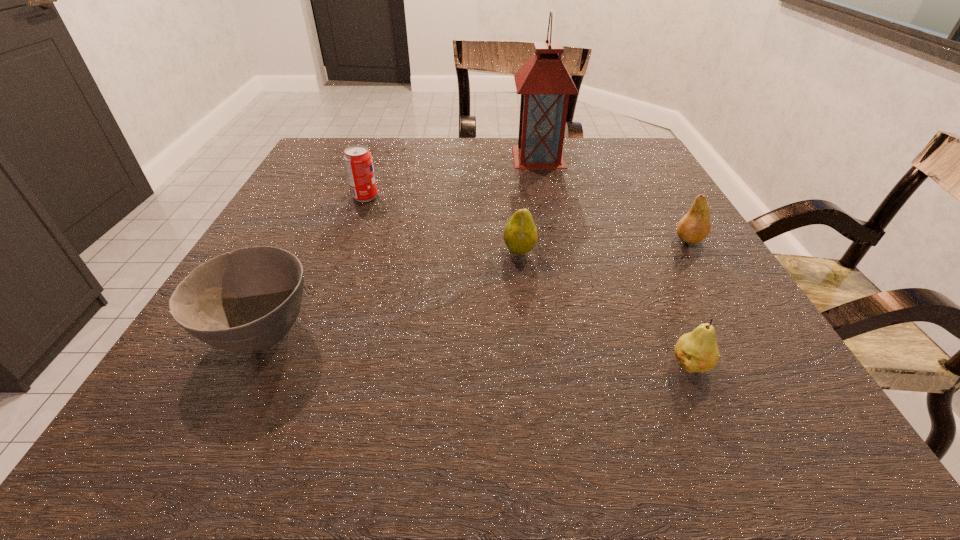
In the image, there is a desktop. Identify the location of vacant space at the right edge. (650, 271).

In the image, there is a desktop. Where is `free space at the far left corner`? free space at the far left corner is located at coordinates (340, 159).

The image size is (960, 540). In order to click on vacant area at the near left corner in this screenshot , I will do `click(175, 420)`.

In the image, there is a desktop. What are the coordinates of `vacant space at the far right corner` in the screenshot? It's located at (598, 157).

Identify the location of vacant area that lies between the rightmost object and the bowl. This screenshot has width=960, height=540. (475, 286).

Identify the location of free space that is in between the leftmost pear and the rightmost object. (604, 245).

Identify the location of unoccupied position between the lantern and the rightmost object. (613, 198).

The image size is (960, 540). Find the location of `free space between the rightmost object and the lantern`. free space between the rightmost object and the lantern is located at coordinates (613, 198).

The width and height of the screenshot is (960, 540). Find the location of `free space that is in between the leftmost pear and the bowl`. free space that is in between the leftmost pear and the bowl is located at coordinates (390, 292).

At what (x,y) coordinates should I click in order to perform the action: click on free area in between the nearest pear and the soda can. Please return your answer as a coordinate pair (x, y). Looking at the image, I should click on (528, 280).